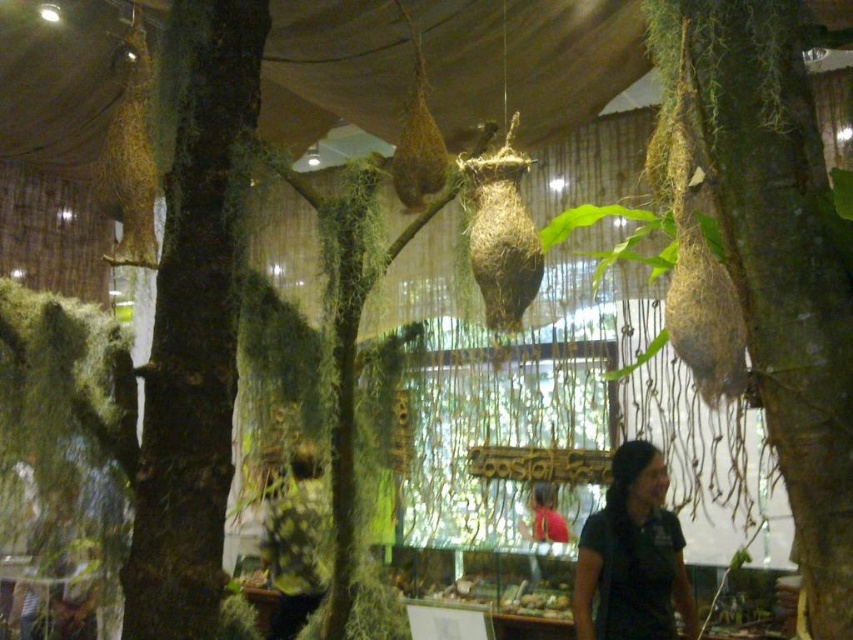
Which is more to the left, green mossy tree at center or black matte shirt at lower right?

Positioned to the left is green mossy tree at center.

Does green mossy tree at center have a lesser height compared to black matte shirt at lower right?

No, green mossy tree at center is not shorter than black matte shirt at lower right.

Is point (770, 435) closer to viewer compared to point (664, 480)?

That is True.

This screenshot has width=853, height=640. I want to click on green mossy tree at center, so pyautogui.click(x=779, y=260).

Who is taller, green mossy tree at center or dark brown leather shirt at lower center?

dark brown leather shirt at lower center

Find the location of a particular element. The height and width of the screenshot is (640, 853). green mossy tree at center is located at coordinates click(779, 260).

This screenshot has width=853, height=640. What do you see at coordinates (779, 260) in the screenshot?
I see `green mossy tree at center` at bounding box center [779, 260].

Where is `green mossy tree at center`? The height and width of the screenshot is (640, 853). green mossy tree at center is located at coordinates (779, 260).

Does dark brown bark at center appear on the left side of dark brown leather shirt at lower center?

Incorrect, dark brown bark at center is not on the left side of dark brown leather shirt at lower center.

The height and width of the screenshot is (640, 853). I want to click on dark brown bark at center, so click(x=193, y=317).